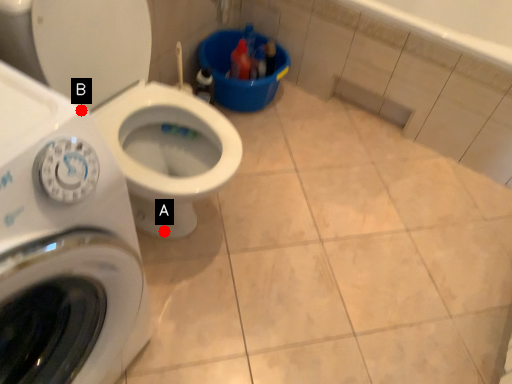
Question: Two points are circled on the image, labeled by A and B beside each circle. Which point is closer to the camera?

Choices:
 (A) A is closer
 (B) B is closer

Answer: (B)